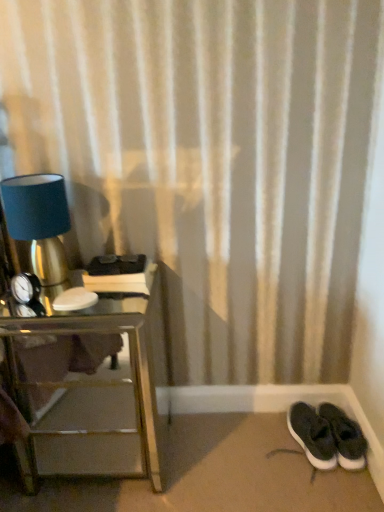
Question: From the image's perspective, does black suede sneakers at lower right appear lower than matte blue lampshade at left?

Choices:
 (A) yes
 (B) no

Answer: (A)

Question: From a real-world perspective, is black suede sneakers at lower right located beneath matte blue lampshade at left?

Choices:
 (A) yes
 (B) no

Answer: (A)

Question: Could matte blue lampshade at left be considered to be inside black suede sneakers at lower right?

Choices:
 (A) yes
 (B) no

Answer: (B)

Question: Does black suede sneakers at lower right have a larger size compared to matte blue lampshade at left?

Choices:
 (A) yes
 (B) no

Answer: (B)

Question: Considering the relative sizes of black suede sneakers at lower right and matte blue lampshade at left in the image provided, is black suede sneakers at lower right shorter than matte blue lampshade at left?

Choices:
 (A) no
 (B) yes

Answer: (B)

Question: Is black suede sneakers at lower right positioned with its back to matte blue lampshade at left?

Choices:
 (A) yes
 (B) no

Answer: (B)

Question: Is silver mirrored nightstand at left to the right of matte blue lampshade at left from the viewer's perspective?

Choices:
 (A) yes
 (B) no

Answer: (A)

Question: Is silver mirrored nightstand at left further to the viewer compared to matte blue lampshade at left?

Choices:
 (A) no
 (B) yes

Answer: (A)

Question: Can you confirm if silver mirrored nightstand at left is bigger than matte blue lampshade at left?

Choices:
 (A) no
 (B) yes

Answer: (B)

Question: Can you confirm if silver mirrored nightstand at left is smaller than matte blue lampshade at left?

Choices:
 (A) no
 (B) yes

Answer: (A)

Question: Does silver mirrored nightstand at left have a lesser width compared to matte blue lampshade at left?

Choices:
 (A) no
 (B) yes

Answer: (A)

Question: From the image's perspective, would you say silver mirrored nightstand at left is shown under matte blue lampshade at left?

Choices:
 (A) no
 (B) yes

Answer: (B)

Question: Is silver mirrored nightstand at left positioned before black suede sneakers at lower right?

Choices:
 (A) yes
 (B) no

Answer: (A)